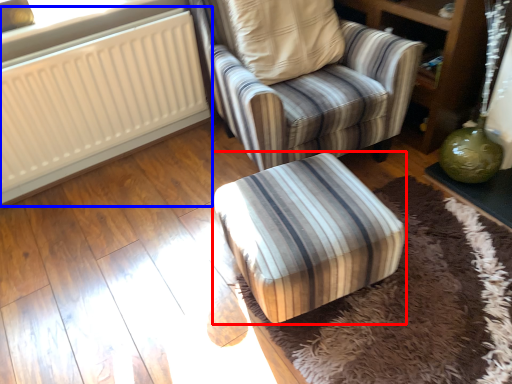
Question: Which point is closer to the camera, furniture (highlighted by a red box) or radiator (highlighted by a blue box)?

Choices:
 (A) furniture
 (B) radiator

Answer: (A)